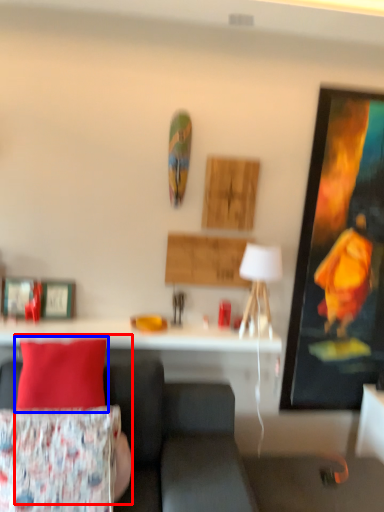
Question: Which of the following is the closest to the observer, person (highlighted by a red box) or pillow (highlighted by a blue box)?

Choices:
 (A) person
 (B) pillow

Answer: (A)